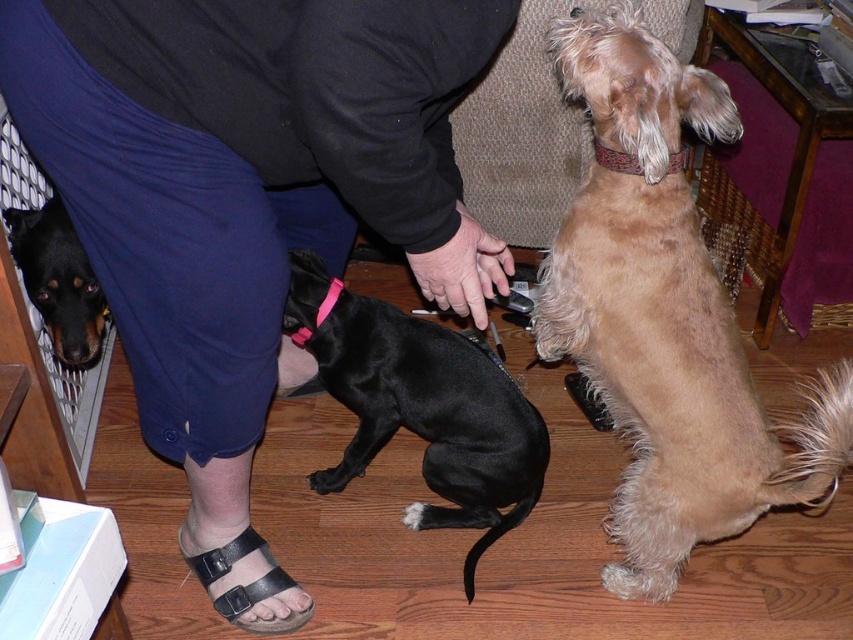
Is black cotton pants at lower left to the left of black leather sandal at lower left from the viewer's perspective?

In fact, black cotton pants at lower left is to the right of black leather sandal at lower left.

Can you confirm if black cotton pants at lower left is shorter than black leather sandal at lower left?

No.

Where is `black cotton pants at lower left`? Image resolution: width=853 pixels, height=640 pixels. black cotton pants at lower left is located at coordinates (245, 182).

Is the position of black smooth dog at center less distant than that of black leather sandal at lower left?

No, it is behind black leather sandal at lower left.

Is black smooth dog at center bigger than black leather sandal at lower left?

Indeed, black smooth dog at center has a larger size compared to black leather sandal at lower left.

Measure the distance between black smooth dog at center and camera.

black smooth dog at center is 1.44 meters from camera.

Locate an element on the screen. black smooth dog at center is located at coordinates (422, 406).

Is light brown fur at upper right to the left of black smooth dog at center from the viewer's perspective?

Incorrect, light brown fur at upper right is not on the left side of black smooth dog at center.

Between point (582, 211) and point (364, 388), which one is positioned in front?

Point (582, 211)

Where is `light brown fur at upper right`? This screenshot has height=640, width=853. light brown fur at upper right is located at coordinates (666, 316).